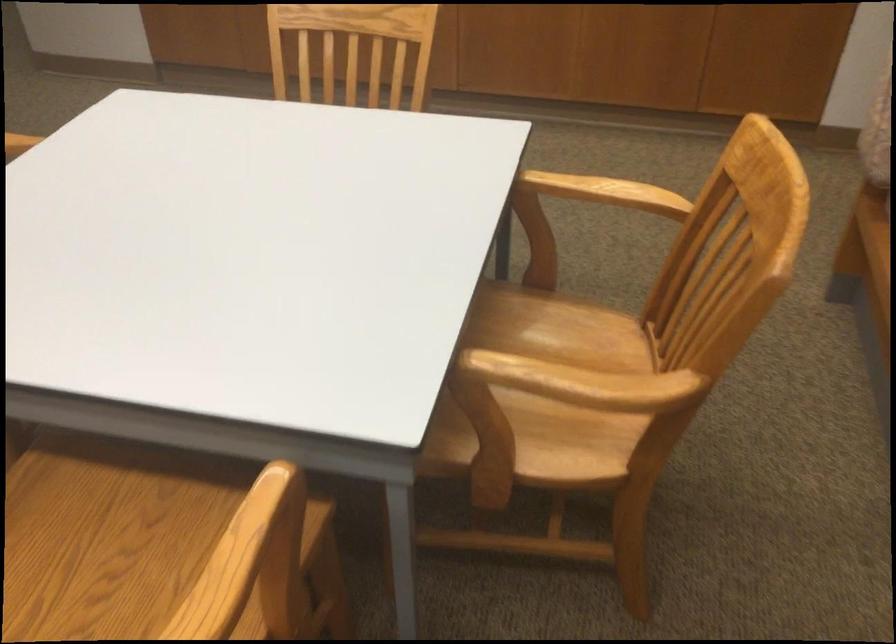
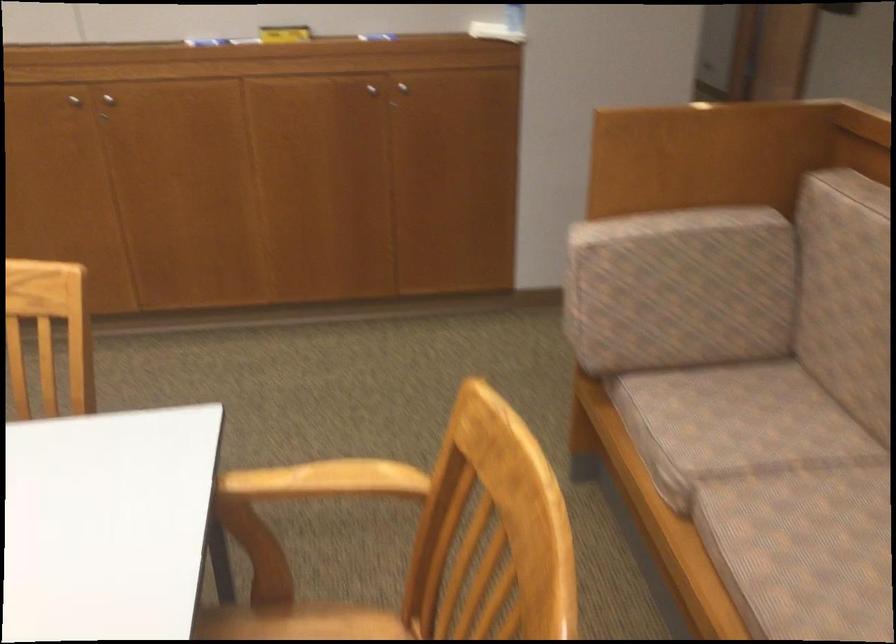
Which direction would the cameraman need to move to produce the second image?

The movement direction of the cameraman is right, forward.